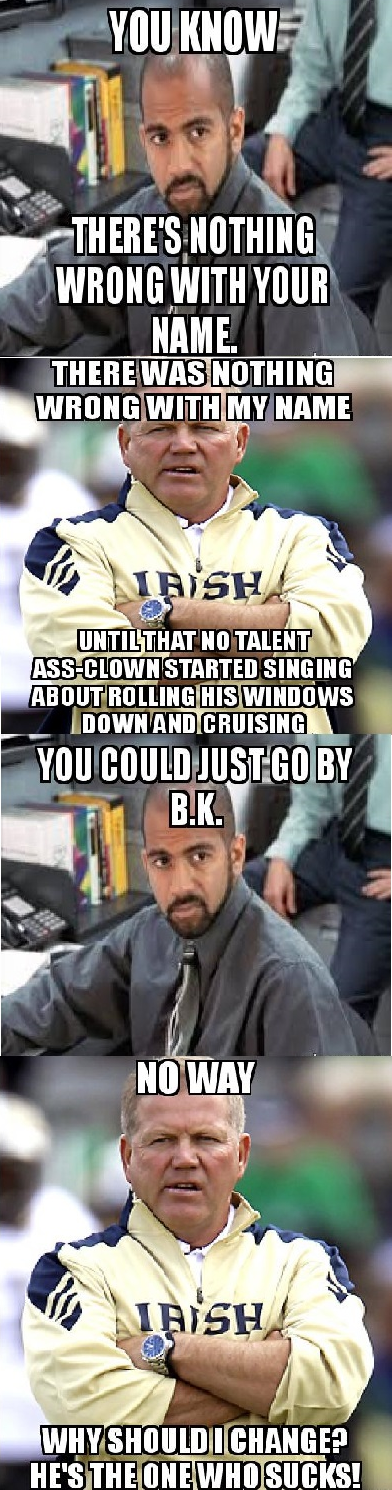
Identify the location of screenshot from office space. (214, 912), (216, 156).